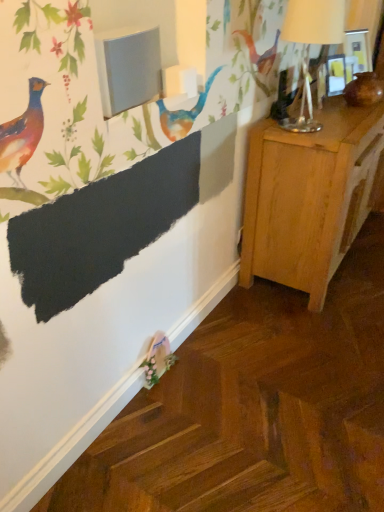
Question: From the image's perspective, would you say light wood nightstand at right is positioned over metallic silver table lamp at upper right?

Choices:
 (A) no
 (B) yes

Answer: (A)

Question: Considering the relative sizes of light wood nightstand at right and metallic silver table lamp at upper right in the image provided, is light wood nightstand at right thinner than metallic silver table lamp at upper right?

Choices:
 (A) yes
 (B) no

Answer: (B)

Question: Is metallic silver table lamp at upper right inside light wood nightstand at right?

Choices:
 (A) no
 (B) yes

Answer: (A)

Question: From a real-world perspective, is light wood nightstand at right on metallic silver table lamp at upper right?

Choices:
 (A) no
 (B) yes

Answer: (A)

Question: Is light wood nightstand at right not close to metallic silver table lamp at upper right?

Choices:
 (A) yes
 (B) no

Answer: (B)

Question: From a real-world perspective, is light wood nightstand at right beneath metallic silver table lamp at upper right?

Choices:
 (A) no
 (B) yes

Answer: (B)

Question: Is the surface of metallic silver table lamp at upper right in direct contact with light wood nightstand at right?

Choices:
 (A) no
 (B) yes

Answer: (A)

Question: Is light wood nightstand at right inside metallic silver table lamp at upper right?

Choices:
 (A) no
 (B) yes

Answer: (A)

Question: Is metallic silver table lamp at upper right to the right of light wood nightstand at right from the viewer's perspective?

Choices:
 (A) no
 (B) yes

Answer: (A)

Question: From a real-world perspective, is metallic silver table lamp at upper right positioned under light wood nightstand at right based on gravity?

Choices:
 (A) no
 (B) yes

Answer: (A)

Question: Could you tell me if metallic silver table lamp at upper right is turned towards light wood nightstand at right?

Choices:
 (A) no
 (B) yes

Answer: (A)

Question: From the image's perspective, is metallic silver table lamp at upper right on light wood nightstand at right?

Choices:
 (A) yes
 (B) no

Answer: (A)

Question: Considering the positions of point (264, 144) and point (306, 91), is point (264, 144) closer or farther from the camera than point (306, 91)?

Choices:
 (A) closer
 (B) farther

Answer: (A)